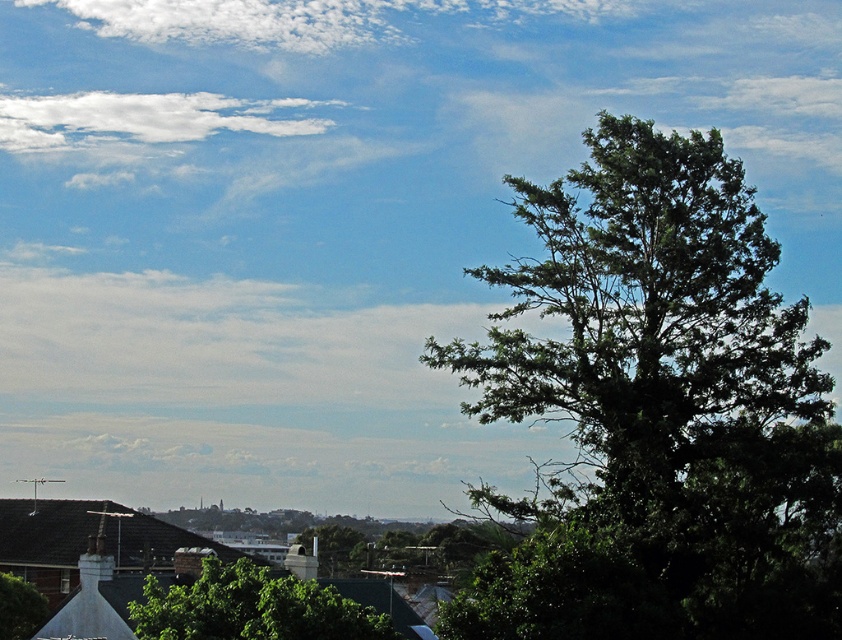
You are standing in the suburban landscape and want to know which object is taller between the green leafy tree at right and the white fluffy cloud at upper center. Can you determine this based on their positions?

The green leafy tree at right is much taller than the white fluffy cloud at upper center according to their positions.